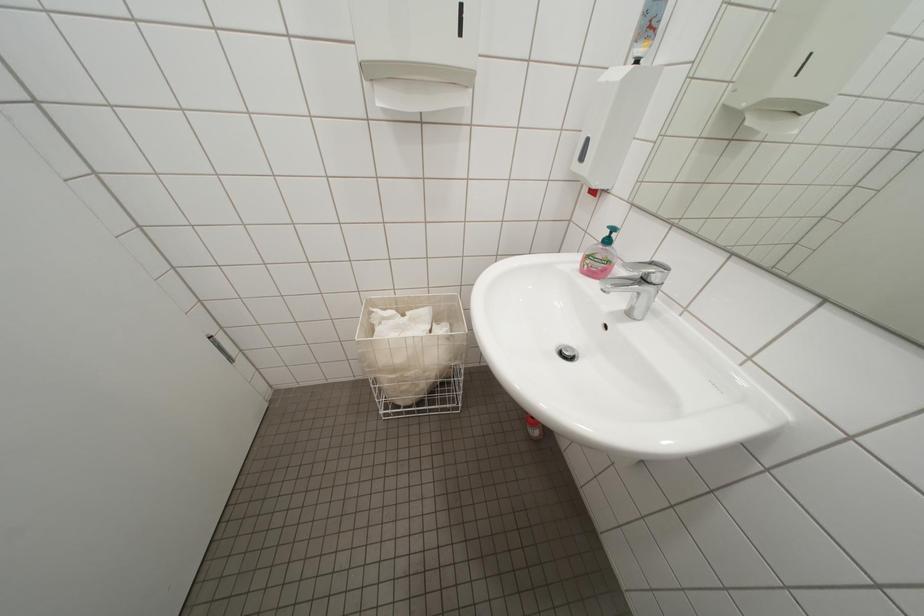
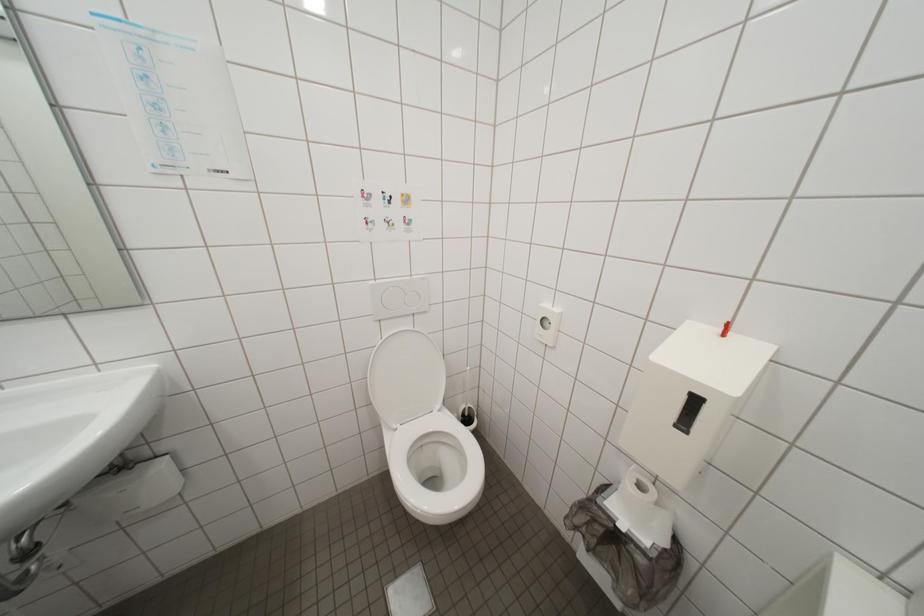
The images are taken continuously from a first-person perspective. In which direction is your viewpoint rotating?

The rotation direction of the camera is right-down.